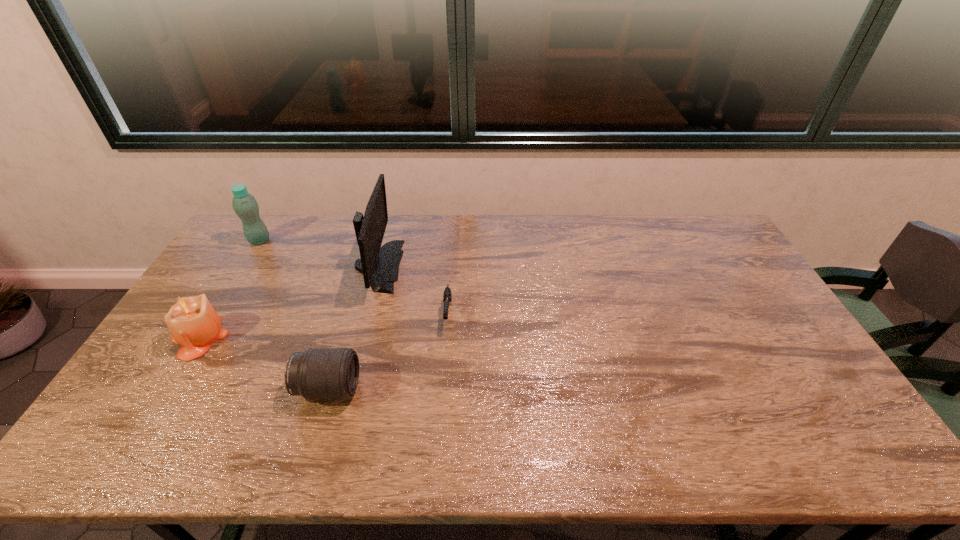
This screenshot has height=540, width=960. I want to click on blank region between the gun and the second shortest object, so click(388, 351).

Find the location of `free space between the candle and the water bottle`. free space between the candle and the water bottle is located at coordinates (229, 289).

Locate an element on the screen. free spot between the rightmost object and the third shortest object is located at coordinates (324, 326).

Locate an element on the screen. unoccupied position between the shortest object and the second shortest object is located at coordinates (388, 351).

Identify the location of free space between the rightmost object and the third tallest object. The image size is (960, 540). (324, 326).

The height and width of the screenshot is (540, 960). Identify the location of free space between the candle and the monitor. (289, 301).

The height and width of the screenshot is (540, 960). What are the coordinates of `free space between the rightmost object and the water bottle` in the screenshot? It's located at (353, 278).

Locate an element on the screen. This screenshot has height=540, width=960. free space between the water bottle and the gun is located at coordinates (353, 278).

Where is `free spot between the water bottle and the gun`? free spot between the water bottle and the gun is located at coordinates click(x=353, y=278).

Locate which object is the closest to the monitor. Please provide its 2D coordinates. Your answer should be formatted as a tuple, i.e. [(x, y)], where the tuple contains the x and y coordinates of a point satisfying the conditions above.

[(447, 295)]